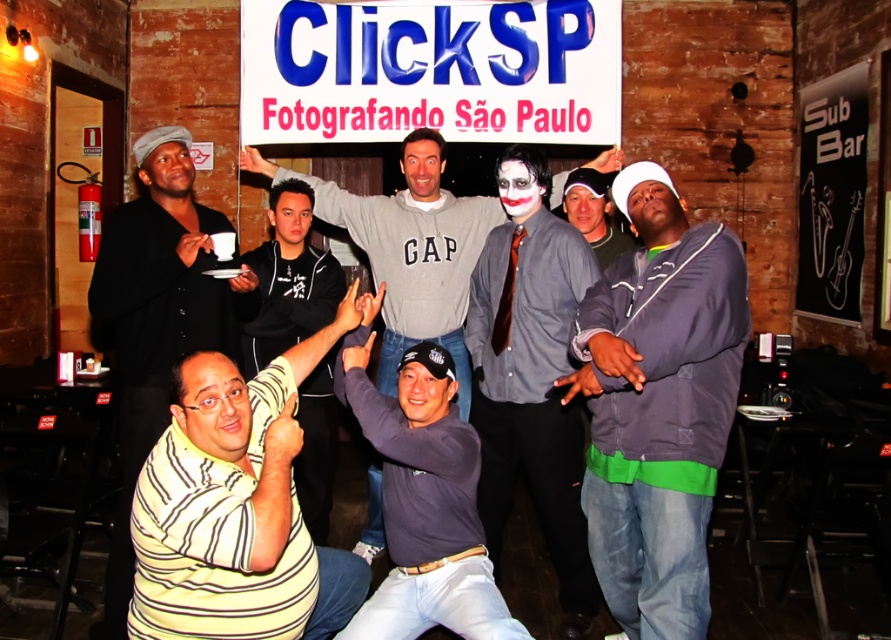
You are a photographer at the event and want to ensure both the black matte shirt at center and the white matte shirt at center are clearly visible in your photo. Given their sizes, which shirt might you need to adjust your camera angle to highlight better?

The black matte shirt at center is larger in size than the white matte shirt at center, so you might need to adjust your camera angle to ensure the larger black matte shirt at center doesn not overshadow the smaller white matte shirt at center.

You are a photographer trying to capture a group photo. The dark gray hoodie at right and the yellow striped shirt at lower left are in your frame. Which clothing item appears narrower in the photo?

The dark gray hoodie at right appears narrower in the photo because it is thinner than the yellow striped shirt at lower left.